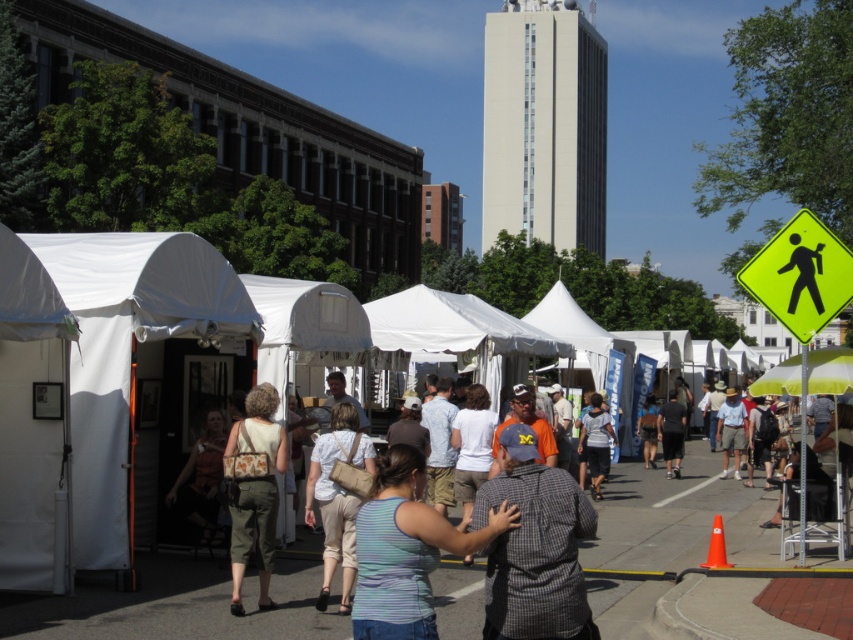
Question: Which of the following is the farthest from the observer?

Choices:
 (A) (62, 474)
 (B) (723, 412)

Answer: (B)

Question: From the image, what is the correct spatial relationship of striped fabric shirt at center in relation to beige fabric purse at center?

Choices:
 (A) above
 (B) below

Answer: (A)

Question: Estimate the real-world distances between objects in this image. Which object is farther from the black fabric at center?

Choices:
 (A) beige fabric purse at center
 (B) orange fabric purse at left
 (C) khaki shorts at center
 (D) camouflage-patterned bag at center

Answer: (D)

Question: Considering the real-world distances, which object is closest to the camouflage-patterned bag at center?

Choices:
 (A) orange fabric purse at left
 (B) beige fabric purse at center
 (C) yellow reflective plastic pedestrian crossing sign at upper right

Answer: (B)

Question: Can you confirm if plaid shirt at center is thinner than yellow reflective plastic pedestrian crossing sign at upper right?

Choices:
 (A) yes
 (B) no

Answer: (A)

Question: Can you confirm if camouflage-patterned bag at center is thinner than black fabric at center?

Choices:
 (A) no
 (B) yes

Answer: (B)